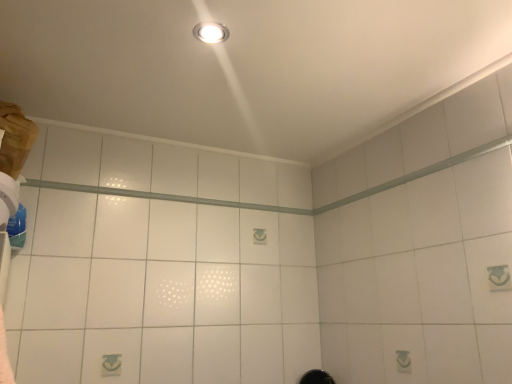
What do you see at coordinates (211, 32) in the screenshot? The height and width of the screenshot is (384, 512). I see `matte white light fixture at upper center` at bounding box center [211, 32].

What is the approximate width of matte white light fixture at upper center?

The width of matte white light fixture at upper center is 3.52 inches.

Find the location of a particular element. Image resolution: width=512 pixels, height=384 pixels. matte white light fixture at upper center is located at coordinates (211, 32).

You are a GUI agent. You are given a task and a screenshot of the screen. Output one action in this format:
    pyautogui.click(x=<x>, y=<y>)
    Task: Click on the matte white light fixture at upper center
    
    Given the screenshot: What is the action you would take?
    [x=211, y=32]